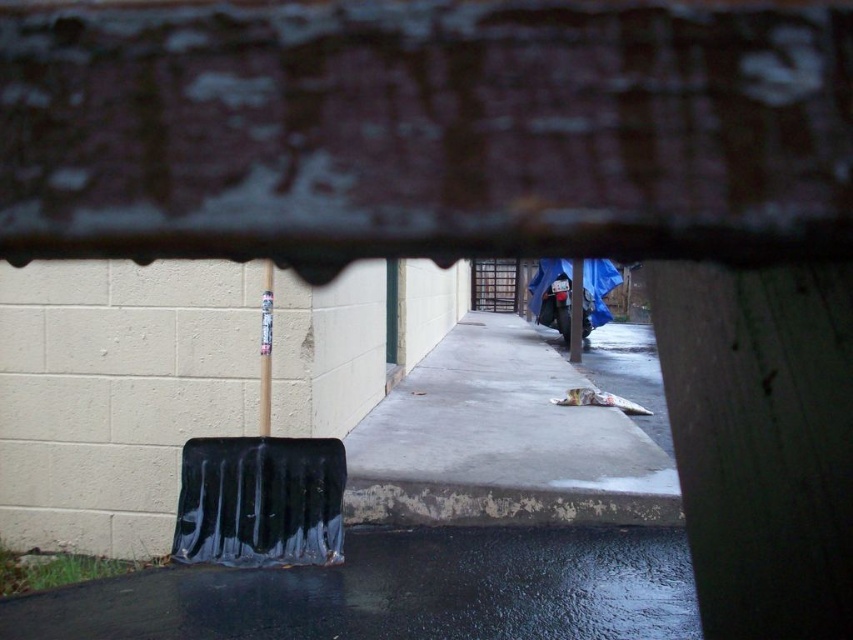
Between smooth concrete sidewalk at center and smooth white pole at center, which one is positioned higher?

smooth white pole at center is above.

Is smooth concrete sidewalk at center to the right of smooth white pole at center from the viewer's perspective?

Correct, you'll find smooth concrete sidewalk at center to the right of smooth white pole at center.

The height and width of the screenshot is (640, 853). Find the location of `smooth concrete sidewalk at center`. smooth concrete sidewalk at center is located at coordinates (502, 442).

Does black rubber shovel at lower left lie behind smooth concrete sidewalk at center?

That is False.

Between black rubber shovel at lower left and smooth concrete sidewalk at center, which one is positioned lower?

Result: black rubber shovel at lower left is below.

Describe the element at coordinates (397, 592) in the screenshot. I see `black rubber shovel at lower left` at that location.

The width and height of the screenshot is (853, 640). Identify the location of black rubber shovel at lower left. (397, 592).

Can you confirm if smooth concrete sidewalk at center is bigger than metallic silver pole at center?

Indeed, smooth concrete sidewalk at center has a larger size compared to metallic silver pole at center.

The image size is (853, 640). Describe the element at coordinates (502, 442) in the screenshot. I see `smooth concrete sidewalk at center` at that location.

Does point (467, 424) come behind point (572, 310)?

No, (467, 424) is closer to viewer.

The image size is (853, 640). What are the coordinates of `smooth concrete sidewalk at center` in the screenshot? It's located at (502, 442).